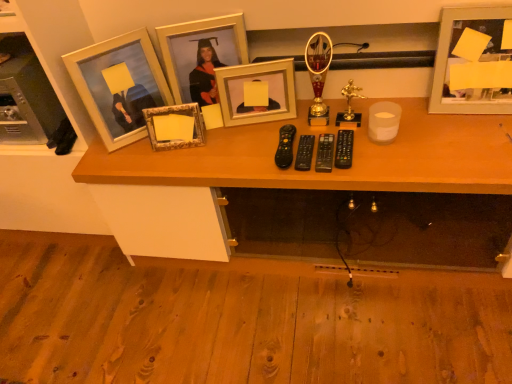
Image resolution: width=512 pixels, height=384 pixels. Describe the element at coordinates (255, 84) in the screenshot. I see `gold metallic picture frame at center, marked as the second picture frame in a right-to-left arrangement` at that location.

How much space does gold metallic picture frame at upper center, arranged as the 3th picture frame when viewed from the left, occupy horizontally?

3.09 inches.

Measure the distance between matte wooden picture frame at left, the fifth picture frame when ordered from right to left, and camera.

matte wooden picture frame at left, the fifth picture frame when ordered from right to left, and camera are 1.23 meters apart from each other.

The width and height of the screenshot is (512, 384). I want to click on wooden desk at center, so click(334, 168).

Find the location of a particular element. This screenshot has height=384, width=512. gold metallic picture frame at center, which is counted as the 4th picture frame, starting from the left is located at coordinates (255, 84).

Who is taller, gold metallic picture frame at upper center, arranged as the 3th picture frame when viewed from the left, or gold metallic picture frame at center, which is counted as the 4th picture frame, starting from the left?

gold metallic picture frame at upper center, arranged as the 3th picture frame when viewed from the left.

In the scene shown: Which object is positioned more to the right, gold metallic picture frame at upper center, arranged as the 3th picture frame when viewed from the left, or gold metallic picture frame at center, which is counted as the 4th picture frame, starting from the left?

gold metallic picture frame at center, which is counted as the 4th picture frame, starting from the left.

Does gold metallic picture frame at upper center, placed as the third picture frame when sorted from right to left, touch gold metallic picture frame at center, marked as the second picture frame in a right-to-left arrangement?

No, gold metallic picture frame at upper center, placed as the third picture frame when sorted from right to left, is not beside gold metallic picture frame at center, marked as the second picture frame in a right-to-left arrangement.

How many degrees apart are the facing directions of gold metallic picture frame at upper center, placed as the third picture frame when sorted from right to left, and gold metallic picture frame at center, marked as the second picture frame in a right-to-left arrangement?

4.45 degrees.

Is matte wooden picture frame at left, the fifth picture frame when ordered from right to left, inside the boundaries of metallic silver picture frame at upper right, the fifth picture frame in the left-to-right sequence, or outside?

matte wooden picture frame at left, the fifth picture frame when ordered from right to left, exists outside the volume of metallic silver picture frame at upper right, the fifth picture frame in the left-to-right sequence.

From the image's perspective, which picture frame is the 2nd one above the matte wooden picture frame at left, the 1th picture frame viewed from the left? Please provide its 2D coordinates.

[(473, 62)]

Could you tell me if matte wooden picture frame at left, the 1th picture frame viewed from the left, is turned towards metallic silver picture frame at upper right, the first picture frame from the right?

No, matte wooden picture frame at left, the 1th picture frame viewed from the left, is not turned towards metallic silver picture frame at upper right, the first picture frame from the right.

From the picture: Considering the sizes of objects matte wooden picture frame at left, the 1th picture frame viewed from the left, and metallic silver picture frame at upper right, the fifth picture frame in the left-to-right sequence, in the image provided, who is thinner, matte wooden picture frame at left, the 1th picture frame viewed from the left, or metallic silver picture frame at upper right, the fifth picture frame in the left-to-right sequence,?

Thinner between the two is matte wooden picture frame at left, the 1th picture frame viewed from the left.

Is gold metallic picture frame at center, marked as the second picture frame in a right-to-left arrangement, surrounded by gold textured photo frame at center, which is the fourth picture frame in right-to-left order?

Definitely not — gold metallic picture frame at center, marked as the second picture frame in a right-to-left arrangement, is not inside gold textured photo frame at center, which is the fourth picture frame in right-to-left order.

From the picture: Is gold textured photo frame at center, which is the fourth picture frame in right-to-left order, bigger or smaller than gold metallic picture frame at center, marked as the second picture frame in a right-to-left arrangement?

gold textured photo frame at center, which is the fourth picture frame in right-to-left order, is smaller than gold metallic picture frame at center, marked as the second picture frame in a right-to-left arrangement.

Considering the relative sizes of gold textured photo frame at center, which is the fourth picture frame in right-to-left order, and gold metallic picture frame at center, marked as the second picture frame in a right-to-left arrangement, in the image provided, is gold textured photo frame at center, which is the fourth picture frame in right-to-left order, shorter than gold metallic picture frame at center, marked as the second picture frame in a right-to-left arrangement,?

Yes.

From the image's perspective, between gold textured photo frame at center, which is the fourth picture frame in right-to-left order, and gold metallic picture frame at center, marked as the second picture frame in a right-to-left arrangement, who is located below?

gold textured photo frame at center, which is the fourth picture frame in right-to-left order, from the image's perspective.

Looking at this image, from a real-world perspective, is matte wooden picture frame at left, the fifth picture frame when ordered from right to left, physically below gold metallic picture frame at center, marked as the second picture frame in a right-to-left arrangement?

Incorrect, from a real-world perspective, matte wooden picture frame at left, the fifth picture frame when ordered from right to left, is higher than gold metallic picture frame at center, marked as the second picture frame in a right-to-left arrangement.

How many degrees apart are the facing directions of matte wooden picture frame at left, the fifth picture frame when ordered from right to left, and gold metallic picture frame at center, marked as the second picture frame in a right-to-left arrangement?

29.9 degrees separate the facing orientations of matte wooden picture frame at left, the fifth picture frame when ordered from right to left, and gold metallic picture frame at center, marked as the second picture frame in a right-to-left arrangement.

Is gold metallic picture frame at center, marked as the second picture frame in a right-to-left arrangement, surrounded by matte wooden picture frame at left, the fifth picture frame when ordered from right to left?

No, gold metallic picture frame at center, marked as the second picture frame in a right-to-left arrangement, is located outside of matte wooden picture frame at left, the fifth picture frame when ordered from right to left.

Is matte wooden picture frame at left, the 1th picture frame viewed from the left, looking in the opposite direction of gold metallic picture frame at center, marked as the second picture frame in a right-to-left arrangement?

No, gold metallic picture frame at center, marked as the second picture frame in a right-to-left arrangement, is not at the back of matte wooden picture frame at left, the 1th picture frame viewed from the left.

Which is nearer, (438, 143) or (443, 66)?

The point (438, 143) is closer.

Is metallic silver picture frame at upper right, the fifth picture frame in the left-to-right sequence, at the back of wooden desk at center?

No, metallic silver picture frame at upper right, the fifth picture frame in the left-to-right sequence, is not at the back of wooden desk at center.

Which object is closer to the camera, wooden desk at center or metallic silver picture frame at upper right, the first picture frame from the right?

wooden desk at center is more forward.

Does metallic silver picture frame at upper right, the fifth picture frame in the left-to-right sequence, have a lesser height compared to matte wooden picture frame at left, the 1th picture frame viewed from the left?

Incorrect, the height of metallic silver picture frame at upper right, the fifth picture frame in the left-to-right sequence, does not fall short of that of matte wooden picture frame at left, the 1th picture frame viewed from the left.

How many degrees apart are the facing directions of metallic silver picture frame at upper right, the first picture frame from the right, and matte wooden picture frame at left, the 1th picture frame viewed from the left?

The angular difference between metallic silver picture frame at upper right, the first picture frame from the right, and matte wooden picture frame at left, the 1th picture frame viewed from the left, is 42.2 degrees.

Does metallic silver picture frame at upper right, the fifth picture frame in the left-to-right sequence, contain matte wooden picture frame at left, the 1th picture frame viewed from the left?

No.

Is metallic silver picture frame at upper right, the fifth picture frame in the left-to-right sequence, looking in the opposite direction of matte wooden picture frame at left, the 1th picture frame viewed from the left?

No.

Is gold metallic picture frame at upper center, placed as the third picture frame when sorted from right to left, completely or partially outside of wooden desk at center?

gold metallic picture frame at upper center, placed as the third picture frame when sorted from right to left, lies outside wooden desk at center's area.

Where is `the 2nd picture frame to the left when counting from the wooden desk at center`? The image size is (512, 384). the 2nd picture frame to the left when counting from the wooden desk at center is located at coordinates (197, 47).

Which point is more distant from viewer, [169,73] or [361,178]?

Point [169,73]

Could you tell me if gold metallic picture frame at upper center, arranged as the 3th picture frame when viewed from the left, is facing wooden desk at center?

No, gold metallic picture frame at upper center, arranged as the 3th picture frame when viewed from the left, is not turned towards wooden desk at center.

At what (x,y) coordinates should I click in order to perform the action: click on the 1st picture frame positioned below the gold metallic picture frame at upper center, arranged as the 3th picture frame when viewed from the left (from a real-world perspective). Please return your answer as a coordinate pair (x, y). This screenshot has width=512, height=384. Looking at the image, I should click on (255, 84).

The image size is (512, 384). In order to click on picture frame above the matte wooden picture frame at left, the fifth picture frame when ordered from right to left (from a real-world perspective) in this screenshot , I will do pos(473,62).

Considering their positions, is gold metallic picture frame at center, which is counted as the 4th picture frame, starting from the left, positioned closer to gold textured photo frame at center, which is the fourth picture frame in right-to-left order, than wooden desk at center?

gold metallic picture frame at center, which is counted as the 4th picture frame, starting from the left, is closer to gold textured photo frame at center, which is the fourth picture frame in right-to-left order.

Based on their spatial positions, is gold textured photo frame at center, the second picture frame when ordered from left to right, or gold metallic picture frame at upper center, arranged as the 3th picture frame when viewed from the left, further from gold metallic picture frame at center, which is counted as the 4th picture frame, starting from the left?

gold textured photo frame at center, the second picture frame when ordered from left to right.

Based on their spatial positions, is gold metallic picture frame at center, marked as the second picture frame in a right-to-left arrangement, or matte wooden picture frame at left, the fifth picture frame when ordered from right to left, closer to gold metallic picture frame at upper center, arranged as the 3th picture frame when viewed from the left?

The object closer to gold metallic picture frame at upper center, arranged as the 3th picture frame when viewed from the left, is gold metallic picture frame at center, marked as the second picture frame in a right-to-left arrangement.

From the image, which object appears to be farther from gold metallic picture frame at upper center, arranged as the 3th picture frame when viewed from the left, wooden desk at center or matte wooden picture frame at left, the fifth picture frame when ordered from right to left?

The object further to gold metallic picture frame at upper center, arranged as the 3th picture frame when viewed from the left, is wooden desk at center.

From the image, which object appears to be nearer to wooden desk at center, gold textured photo frame at center, which is the fourth picture frame in right-to-left order, or metallic silver picture frame at upper right, the fifth picture frame in the left-to-right sequence?

metallic silver picture frame at upper right, the fifth picture frame in the left-to-right sequence.

Based on their spatial positions, is metallic silver picture frame at upper right, the fifth picture frame in the left-to-right sequence, or wooden desk at center closer to matte wooden picture frame at left, the 1th picture frame viewed from the left?

wooden desk at center lies closer to matte wooden picture frame at left, the 1th picture frame viewed from the left, than the other object.

Estimate the real-world distances between objects in this image. Which object is further from matte wooden picture frame at left, the fifth picture frame when ordered from right to left, metallic silver picture frame at upper right, the fifth picture frame in the left-to-right sequence, or gold textured photo frame at center, which is the fourth picture frame in right-to-left order?

Based on the image, metallic silver picture frame at upper right, the fifth picture frame in the left-to-right sequence, appears to be further to matte wooden picture frame at left, the fifth picture frame when ordered from right to left.

When comparing their distances from gold metallic picture frame at upper center, placed as the third picture frame when sorted from right to left, does gold metallic picture frame at center, marked as the second picture frame in a right-to-left arrangement, or gold textured photo frame at center, the second picture frame when ordered from left to right, seem closer?

gold metallic picture frame at center, marked as the second picture frame in a right-to-left arrangement, is closer to gold metallic picture frame at upper center, placed as the third picture frame when sorted from right to left.

Where is `picture frame between matte wooden picture frame at left, the fifth picture frame when ordered from right to left, and gold metallic picture frame at upper center, arranged as the 3th picture frame when viewed from the left, in the horizontal direction`? picture frame between matte wooden picture frame at left, the fifth picture frame when ordered from right to left, and gold metallic picture frame at upper center, arranged as the 3th picture frame when viewed from the left, in the horizontal direction is located at coordinates (174, 126).

This screenshot has height=384, width=512. I want to click on desk between gold metallic picture frame at center, marked as the second picture frame in a right-to-left arrangement, and metallic silver picture frame at upper right, the fifth picture frame in the left-to-right sequence, from left to right, so click(x=334, y=168).

This screenshot has height=384, width=512. In order to click on picture frame located between gold textured photo frame at center, which is the fourth picture frame in right-to-left order, and gold metallic picture frame at center, marked as the second picture frame in a right-to-left arrangement, in the left-right direction in this screenshot , I will do `click(197, 47)`.

You are a GUI agent. You are given a task and a screenshot of the screen. Output one action in this format:
    pyautogui.click(x=<x>, y=<y>)
    Task: Click on the picture frame located between gold metallic picture frame at upper center, arranged as the 3th picture frame when viewed from the left, and metallic silver picture frame at upper right, the first picture frame from the right, in the left-right direction
    The width and height of the screenshot is (512, 384).
    Given the screenshot: What is the action you would take?
    pyautogui.click(x=255, y=84)